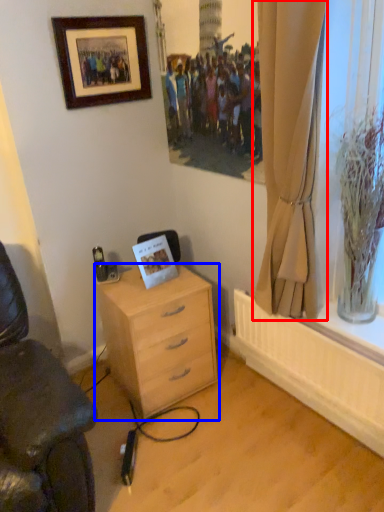
Question: Which object appears farthest to the camera in this image, curtain (highlighted by a red box) or desk (highlighted by a blue box)?

Choices:
 (A) curtain
 (B) desk

Answer: (B)